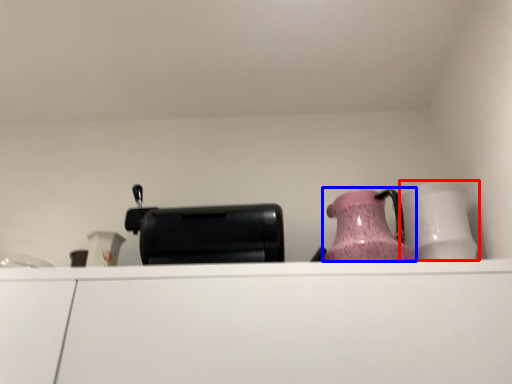
Question: Which of the following is the farthest to the observer, tableware (highlighted by a red box) or jug (highlighted by a blue box)?

Choices:
 (A) tableware
 (B) jug

Answer: (A)